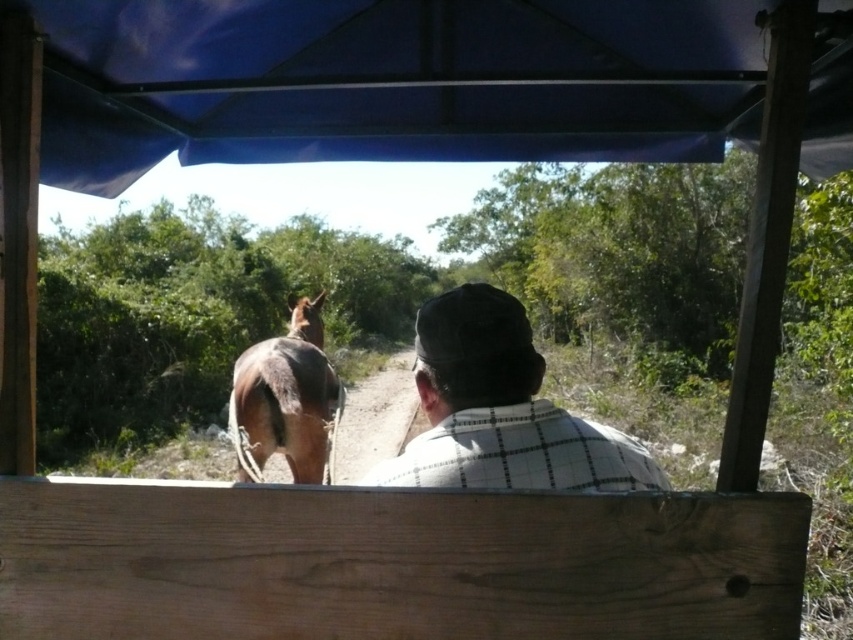
From the picture: You are standing in the wooden structure and want to reach both points marked in the image. Which point, point (512, 310) or point (293, 428), is closer to you?

Point (512, 310) is closer to you than point (293, 428).

You are a passenger in the wooden cart and need to know if the blue fabric canopy at upper center can provide shade for the white checkered shirt at center. Based on their widths, can the canopy cover the shirt completely?

The blue fabric canopy at upper center is wider than the white checkered shirt at center, so it can provide complete shade coverage for the shirt.

You are standing inside the wooden structure and want to locate the blue fabric canopy at upper center and the brown glossy horse at center. From your perspective, which object is positioned to the right of the other?

The blue fabric canopy at upper center is to the right of the brown glossy horse at center.